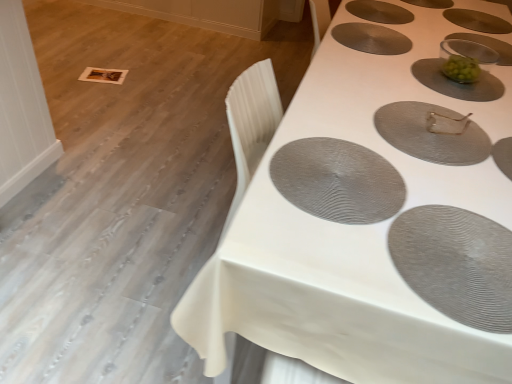
Find the location of a particular element. The image size is (512, 384). free spot in front of matte gray placemat at center, placed as the third oval when sorted from front to back is located at coordinates (457, 180).